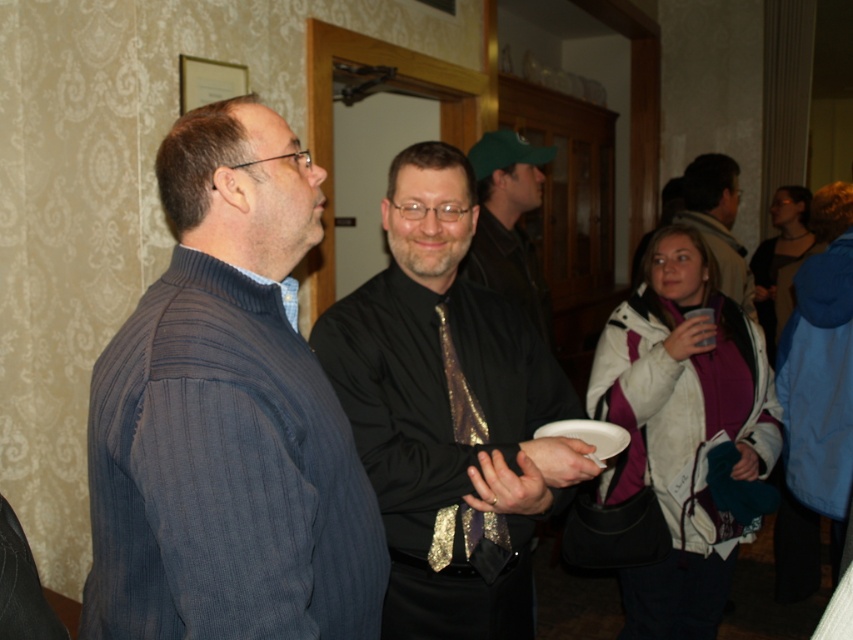
You are at a party and want to grab the shiny black tie at center from the man wearing it. However, there is a white paper plate at center in the way. Can you reach the tie without moving the plate?

The white paper plate at center is behind the shiny black tie at center, so you can reach the tie without moving the plate since it is in front of the plate.

You are organizing a charity event and need to decide which item to place on a 12 inch round table. The matte black shirt at center and the white paper plate at center are both candidates. Based on their sizes, which item would be more appropriate to place on the table?

The white paper plate at center is more appropriate to place on the 12 inch round table because it is smaller than the matte black shirt at center, ensuring it fits better on the table.